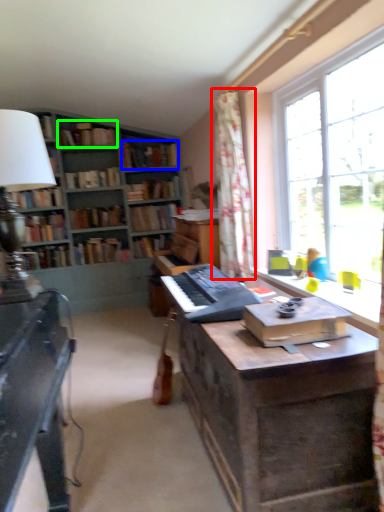
Question: Which is nearer to the curtain (highlighted by a red box)? book (highlighted by a blue box) or book (highlighted by a green box).

Choices:
 (A) book
 (B) book

Answer: (A)